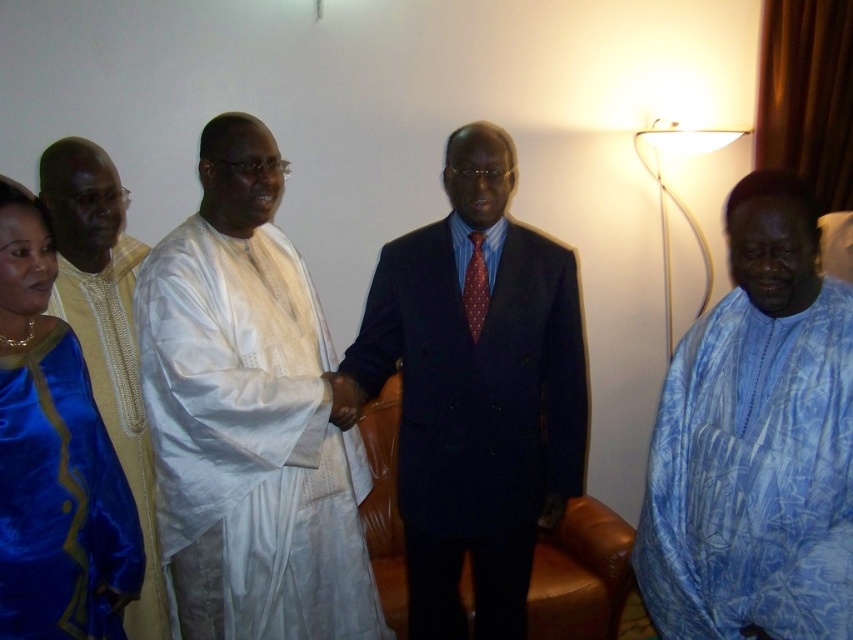
Is dark blue suit at center wider than satin blue dress at left?

Yes, dark blue suit at center is wider than satin blue dress at left.

Based on the photo, is dark blue suit at center positioned at the back of satin blue dress at left?

Yes, it is behind satin blue dress at left.

Is point (410, 230) in front of point (3, 304)?

That is False.

Locate an element on the screen. The image size is (853, 640). dark blue suit at center is located at coordinates (474, 390).

Is point (293, 372) positioned before point (560, 266)?

That is True.

Can you confirm if white cloth at center is taller than dark blue suit at center?

In fact, white cloth at center may be shorter than dark blue suit at center.

This screenshot has height=640, width=853. Find the location of `white cloth at center`. white cloth at center is located at coordinates (248, 417).

Is white cloth at center above blue printed fabric shirt at right?

Incorrect, white cloth at center is not positioned above blue printed fabric shirt at right.

Between white cloth at center and blue printed fabric shirt at right, which one has less height?

Standing shorter between the two is blue printed fabric shirt at right.

Does point (332, 580) lie in front of point (755, 593)?

No, it is behind (755, 593).

Identify the location of white cloth at center. (248, 417).